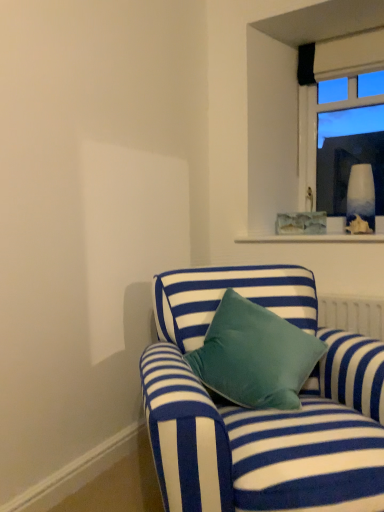
Question: Is point (347, 52) closer or farther from the camera than point (243, 288)?

Choices:
 (A) closer
 (B) farther

Answer: (B)

Question: From their relative heights in the image, would you say clear glass window at upper right is taller or shorter than blue striped fabric couch at lower center?

Choices:
 (A) short
 (B) tall

Answer: (B)

Question: Considering the relative positions of clear glass window at upper right and blue striped fabric couch at lower center in the image provided, is clear glass window at upper right to the left or to the right of blue striped fabric couch at lower center?

Choices:
 (A) right
 (B) left

Answer: (A)

Question: From their relative heights in the image, would you say blue striped fabric couch at lower center is taller or shorter than clear glass window at upper right?

Choices:
 (A) tall
 (B) short

Answer: (B)

Question: Would you say blue striped fabric couch at lower center is to the left or to the right of clear glass window at upper right in the picture?

Choices:
 (A) left
 (B) right

Answer: (A)

Question: From the image's perspective, is blue striped fabric couch at lower center above or below clear glass window at upper right?

Choices:
 (A) above
 (B) below

Answer: (B)

Question: In terms of size, does blue striped fabric couch at lower center appear bigger or smaller than clear glass window at upper right?

Choices:
 (A) big
 (B) small

Answer: (A)